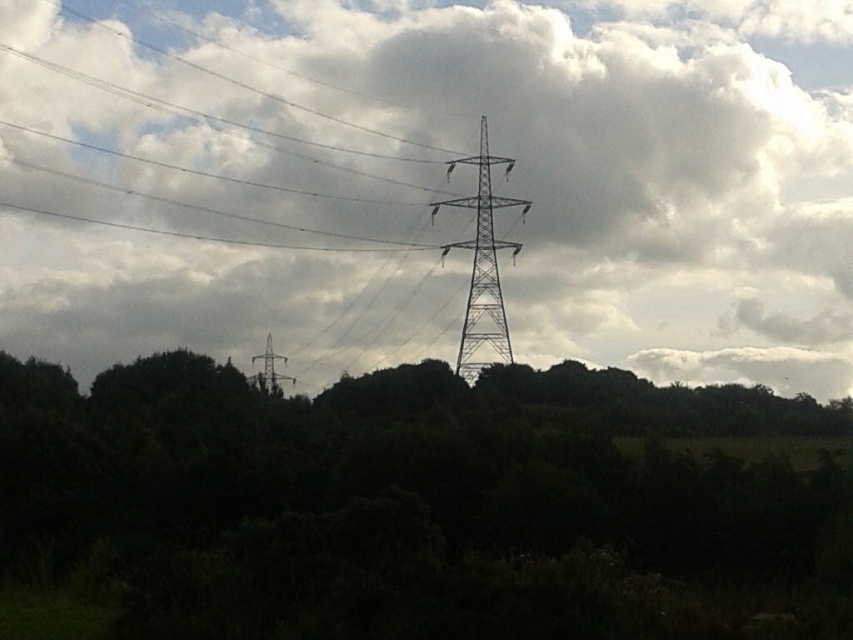
Does point (476, 241) come in front of point (252, 356)?

Yes, point (476, 241) is in front of point (252, 356).

Does metallic silver tower at center have a lesser width compared to metallic gray tower at center?

Yes, metallic silver tower at center is thinner than metallic gray tower at center.

Is point (479, 227) more distant than point (270, 362)?

No, (479, 227) is closer to viewer.

The height and width of the screenshot is (640, 853). I want to click on metallic silver tower at center, so click(x=482, y=266).

Is white fluffy cloud at upper center taller than metallic silver tower at center?

Indeed, white fluffy cloud at upper center has a greater height compared to metallic silver tower at center.

Is white fluffy cloud at upper center below metallic silver tower at center?

No.

Find the location of a particular element. The height and width of the screenshot is (640, 853). white fluffy cloud at upper center is located at coordinates (439, 182).

Does dark green foliage at center have a larger size compared to metallic silver tower at center?

Yes, dark green foliage at center is bigger than metallic silver tower at center.

Is dark green foliage at center above metallic silver tower at center?

Incorrect, dark green foliage at center is not positioned above metallic silver tower at center.

Which is behind, point (151, 557) or point (434, 211)?

The point (434, 211) is more distant.

The image size is (853, 640). I want to click on dark green foliage at center, so 422,502.